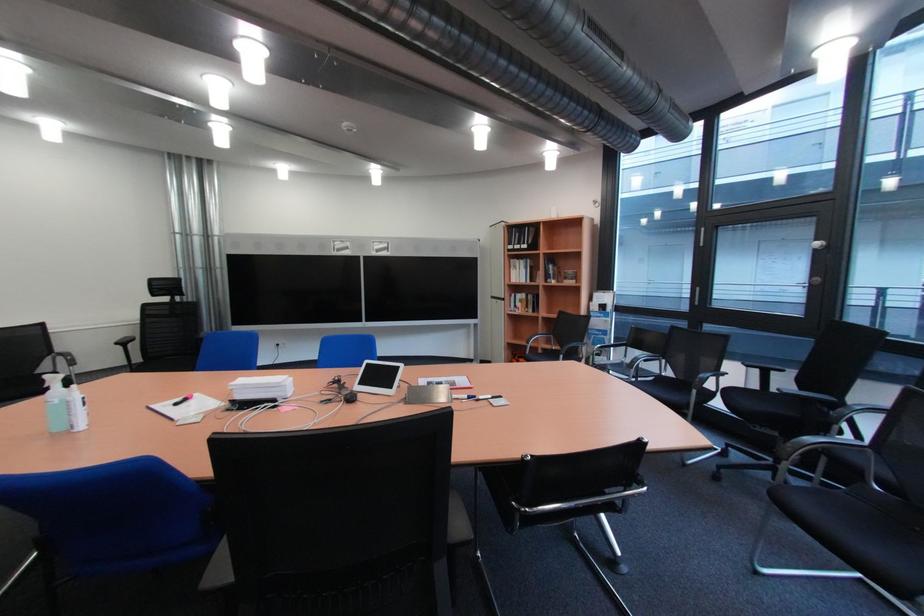
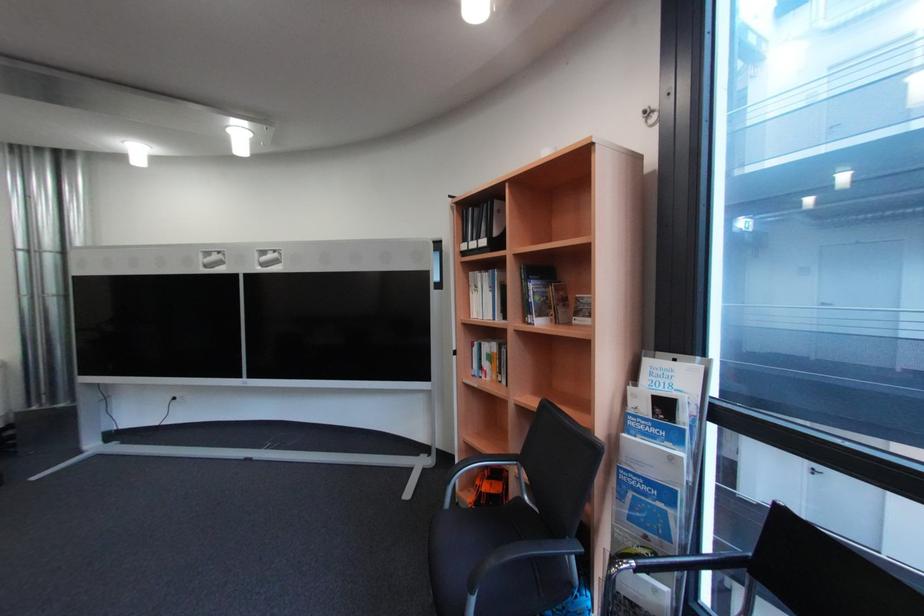
The images are taken continuously from a first-person perspective. In which direction are you moving?

The cameraman moved toward right, forward.